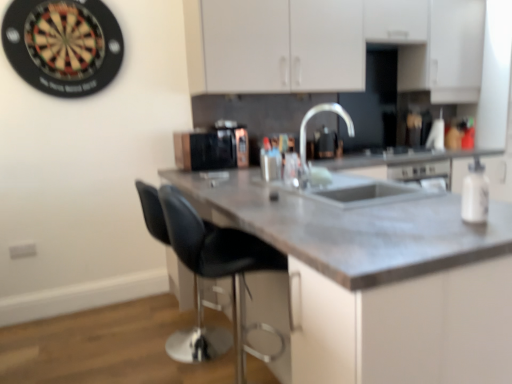
I want to click on blank area to the left of black leather swivel chair at lower left, so click(x=111, y=348).